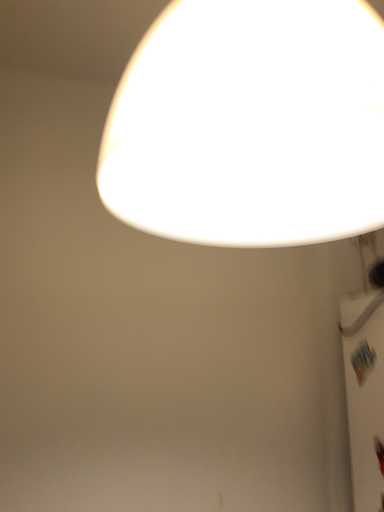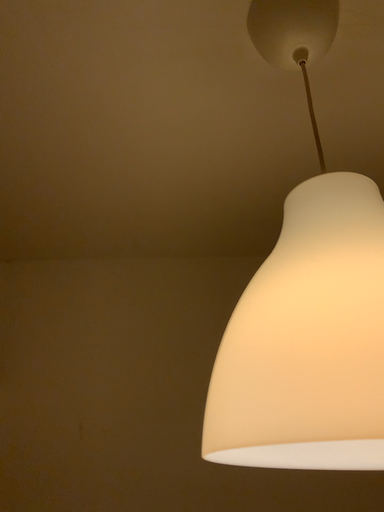
Question: How did the camera likely rotate when shooting the video?

Choices:
 (A) rotated left
 (B) rotated right

Answer: (A)